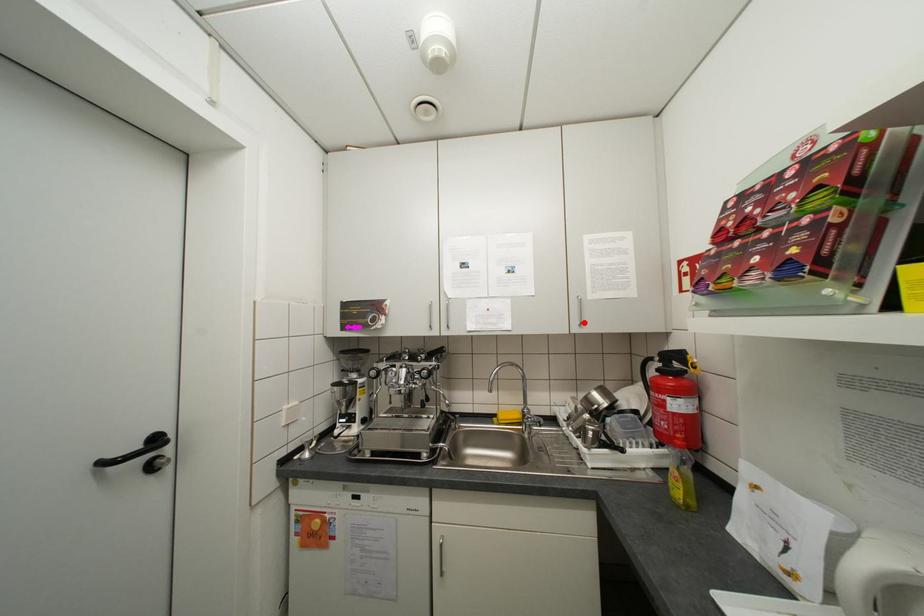
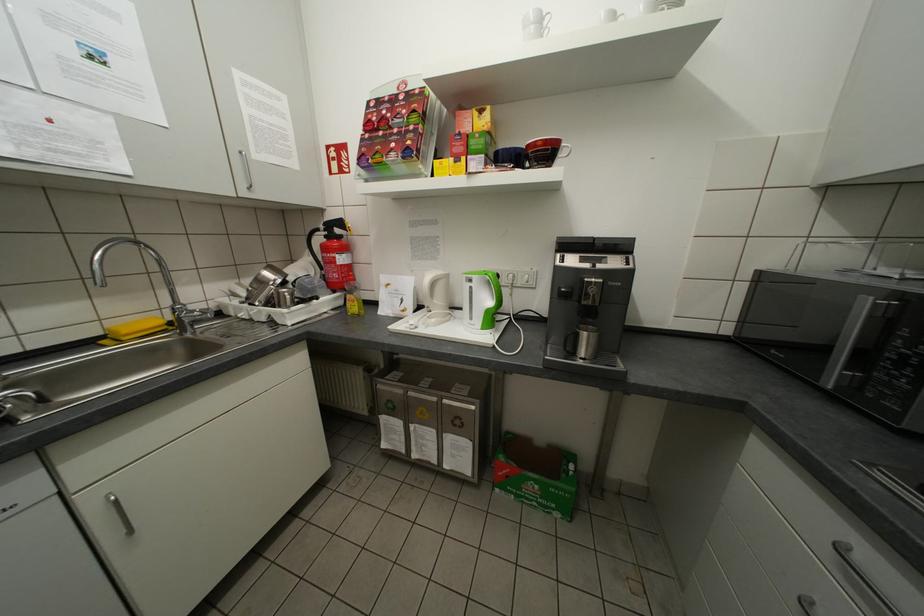
The point at the highlighted location is marked in the first image. Where is the corresponding point in the second image?

(251, 185)